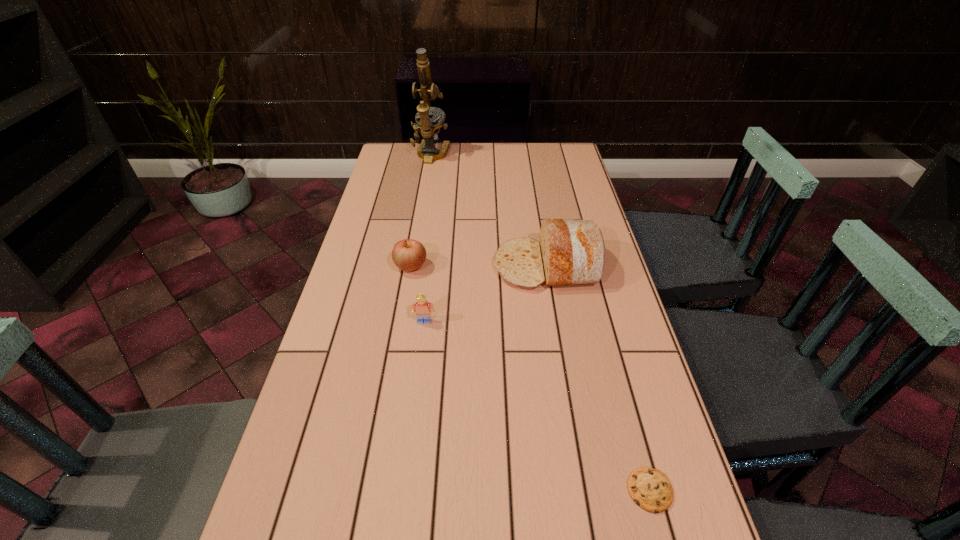
Identify the location of free space at the far edge. The image size is (960, 540). (487, 158).

The width and height of the screenshot is (960, 540). I want to click on vacant space at the left edge of the desktop, so click(285, 524).

Locate an element on the screen. Image resolution: width=960 pixels, height=540 pixels. vacant space at the right edge of the desktop is located at coordinates (593, 213).

In the image, there is a desktop. What are the coordinates of `vacant space at the far left corner` in the screenshot? It's located at (391, 143).

Where is `vacant space at the far right corner`? The width and height of the screenshot is (960, 540). vacant space at the far right corner is located at coordinates (553, 156).

Identify the location of free spot between the tallest object and the shortest object. (540, 322).

Image resolution: width=960 pixels, height=540 pixels. In order to click on free space that is in between the Lego and the second tallest object in this screenshot , I will do `click(485, 294)`.

At what (x,y) coordinates should I click in order to perform the action: click on empty space between the apple and the bread. Please return your answer as a coordinate pair (x, y). Image resolution: width=960 pixels, height=540 pixels. Looking at the image, I should click on (479, 266).

At what (x,y) coordinates should I click in order to perform the action: click on empty space between the apple and the nearest object. Please return your answer as a coordinate pair (x, y). The width and height of the screenshot is (960, 540). Looking at the image, I should click on (530, 379).

You are a GUI agent. You are given a task and a screenshot of the screen. Output one action in this format:
    pyautogui.click(x=<x>, y=<y>)
    Task: Click on the free space between the apple and the cookie
    The height and width of the screenshot is (540, 960).
    Given the screenshot: What is the action you would take?
    pyautogui.click(x=530, y=379)